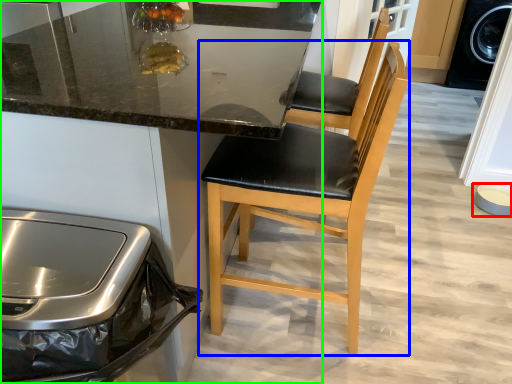
Question: Which object is positioned farthest from bowl (highlighted by a red box)? Select from chair (highlighted by a blue box) and cabinetry (highlighted by a green box).

Choices:
 (A) chair
 (B) cabinetry

Answer: (B)